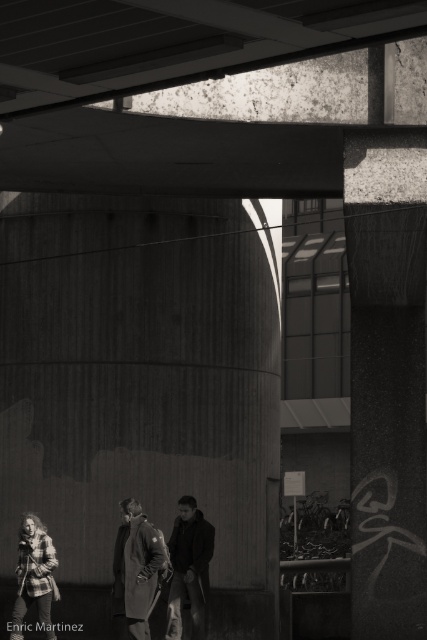
Question: From the image, what is the correct spatial relationship of coarse wool coat at center in relation to plaid flannel shirt at lower left?

Choices:
 (A) left
 (B) right

Answer: (B)

Question: Considering the real-world distances, which object is closest to the plaid flannel shirt at lower left?

Choices:
 (A) coarse wool coat at center
 (B) dark wool coat at center

Answer: (A)

Question: Is coarse wool coat at center wider than dark wool coat at center?

Choices:
 (A) no
 (B) yes

Answer: (B)

Question: Estimate the real-world distances between objects in this image. Which object is closer to the coarse wool coat at center?

Choices:
 (A) dark wool coat at center
 (B) plaid flannel shirt at lower left

Answer: (A)

Question: Is dark wool coat at center to the left of plaid flannel shirt at lower left from the viewer's perspective?

Choices:
 (A) no
 (B) yes

Answer: (A)

Question: Estimate the real-world distances between objects in this image. Which object is farther from the coarse wool coat at center?

Choices:
 (A) dark wool coat at center
 (B) plaid flannel shirt at lower left

Answer: (B)